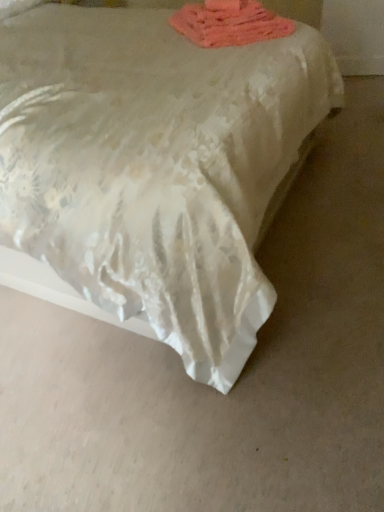
Describe the element at coordinates (155, 167) in the screenshot. I see `white satin bed at center` at that location.

Locate an element on the screen. Image resolution: width=384 pixels, height=512 pixels. white satin bed at center is located at coordinates (155, 167).

This screenshot has height=512, width=384. Find the location of `white satin bed at center`. white satin bed at center is located at coordinates (155, 167).